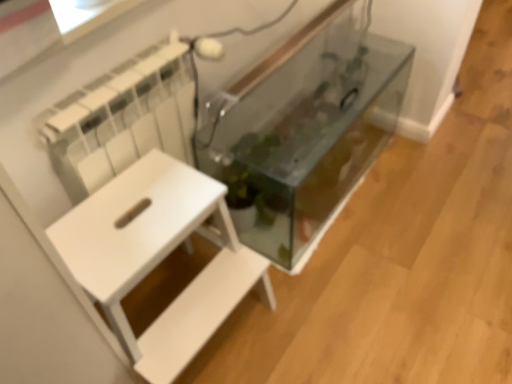
Question: From a real-world perspective, is transparent glass tank at center positioned above or below white matte side table at left?

Choices:
 (A) above
 (B) below

Answer: (B)

Question: Do you think transparent glass tank at center is within white matte side table at left, or outside of it?

Choices:
 (A) outside
 (B) inside

Answer: (A)

Question: Is point (340, 36) positioned closer to the camera than point (222, 210)?

Choices:
 (A) farther
 (B) closer

Answer: (A)

Question: Looking at their shapes, would you say white matte side table at left is wider or thinner than transparent glass tank at center?

Choices:
 (A) thin
 (B) wide

Answer: (B)

Question: Would you say white matte side table at left is to the left or to the right of transparent glass tank at center in the picture?

Choices:
 (A) right
 (B) left

Answer: (B)

Question: From their relative heights in the image, would you say white matte side table at left is taller or shorter than transparent glass tank at center?

Choices:
 (A) short
 (B) tall

Answer: (B)

Question: Is point (139, 183) closer or farther from the camera than point (227, 104)?

Choices:
 (A) closer
 (B) farther

Answer: (A)